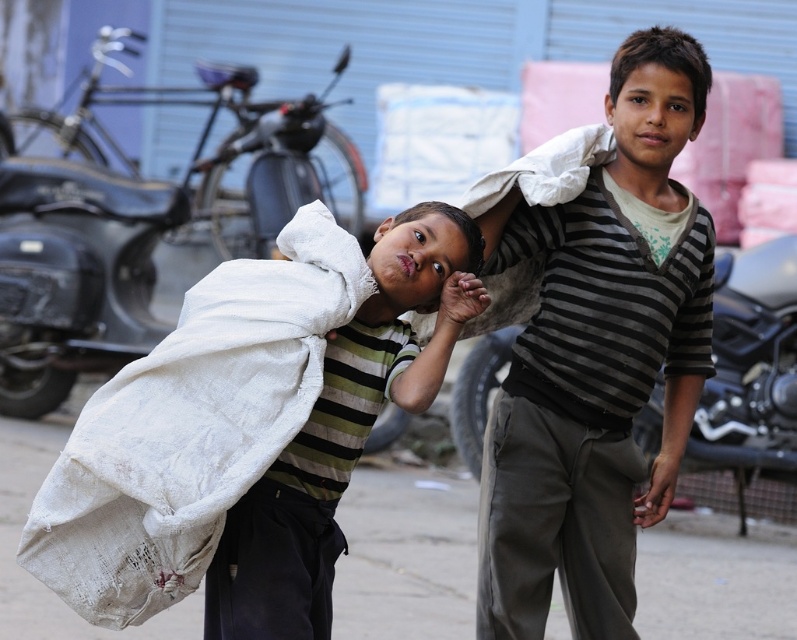
You are a delivery person who needs to place a new package on top of the white woven sack at center. Can you place it there without moving the white fabric bag at center?

The white fabric bag at center is located above the white woven sack at center, so you cannot place the new package on top of the white woven sack at center without moving the white fabric bag at center.